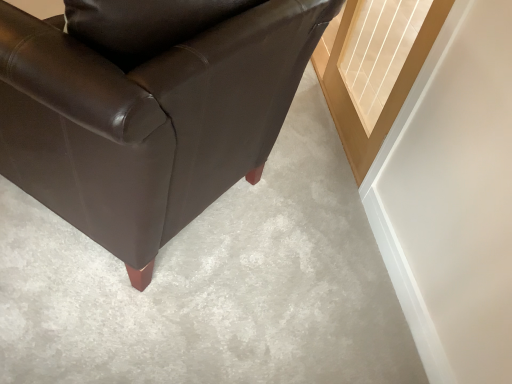
Question: Can you confirm if matte black leather chair at lower left is positioned to the right of clear glass door at upper right?

Choices:
 (A) yes
 (B) no

Answer: (B)

Question: Does matte black leather chair at lower left contain clear glass door at upper right?

Choices:
 (A) no
 (B) yes

Answer: (A)

Question: Does matte black leather chair at lower left have a smaller size compared to clear glass door at upper right?

Choices:
 (A) yes
 (B) no

Answer: (B)

Question: Considering the relative sizes of matte black leather chair at lower left and clear glass door at upper right in the image provided, is matte black leather chair at lower left thinner than clear glass door at upper right?

Choices:
 (A) yes
 (B) no

Answer: (B)

Question: Is matte black leather chair at lower left bigger than clear glass door at upper right?

Choices:
 (A) yes
 (B) no

Answer: (A)

Question: Is the depth of matte black leather chair at lower left less than that of clear glass door at upper right?

Choices:
 (A) yes
 (B) no

Answer: (A)

Question: From a real-world perspective, is clear glass door at upper right positioned under matte black leather chair at lower left based on gravity?

Choices:
 (A) no
 (B) yes

Answer: (B)

Question: Is clear glass door at upper right oriented towards matte black leather chair at lower left?

Choices:
 (A) no
 (B) yes

Answer: (B)

Question: Is clear glass door at upper right in contact with matte black leather chair at lower left?

Choices:
 (A) no
 (B) yes

Answer: (A)

Question: Is clear glass door at upper right wider than matte black leather chair at lower left?

Choices:
 (A) yes
 (B) no

Answer: (B)

Question: Is clear glass door at upper right at the left side of matte black leather chair at lower left?

Choices:
 (A) yes
 (B) no

Answer: (B)

Question: Does clear glass door at upper right have a smaller size compared to matte black leather chair at lower left?

Choices:
 (A) no
 (B) yes

Answer: (B)

Question: In terms of height, does matte black leather chair at lower left look taller or shorter compared to clear glass door at upper right?

Choices:
 (A) tall
 (B) short

Answer: (A)